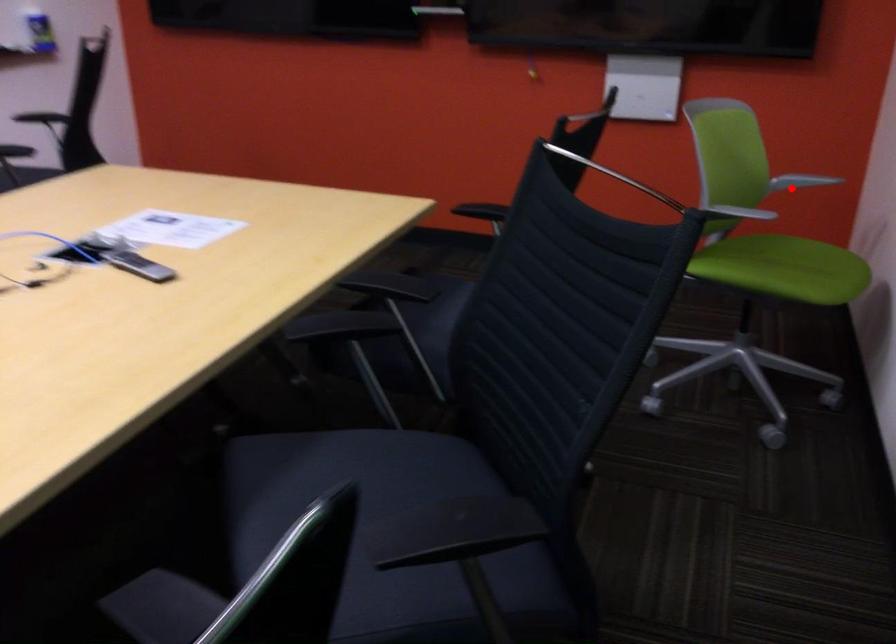
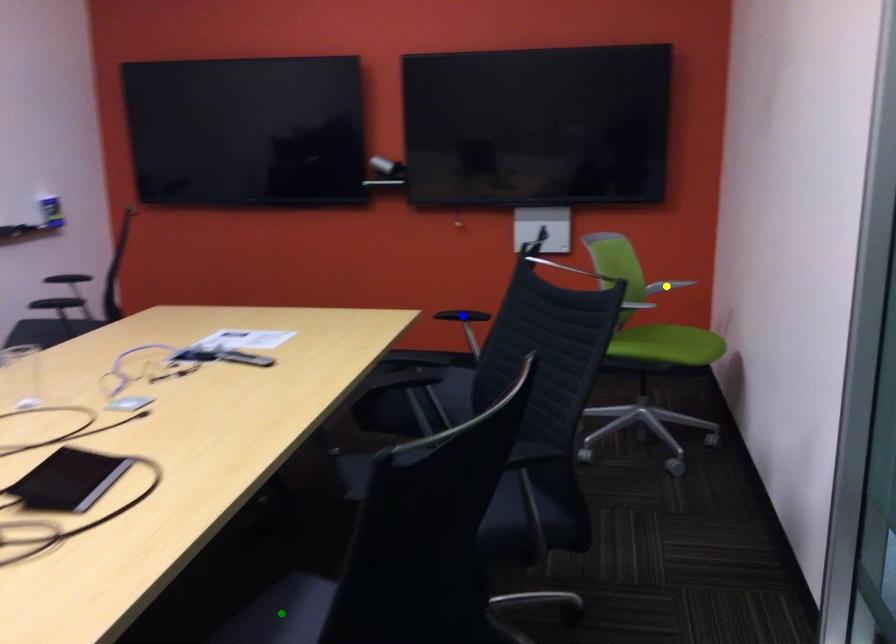
Question: I am providing you with two images of the same scene from different viewpoints. A red point is marked on the first image. You are given multiple points on the second image. Which mark in image 2 goes with the point in image 1?

Choices:
 (A) green point
 (B) blue point
 (C) yellow point

Answer: (C)